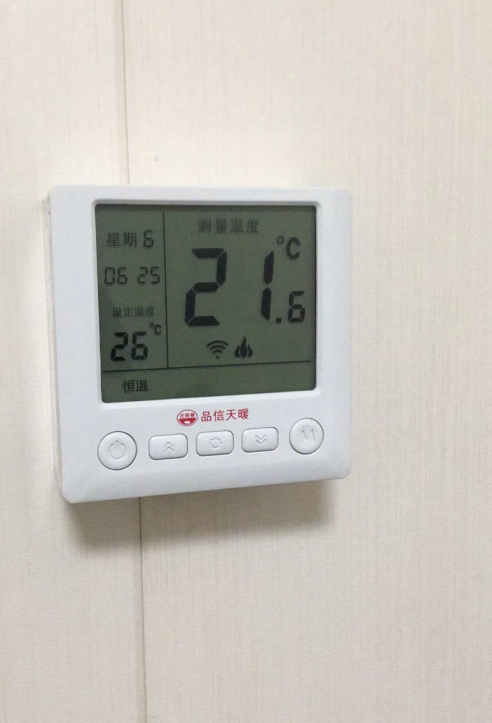
Where is `wall mounted thermostat`? The height and width of the screenshot is (723, 492). wall mounted thermostat is located at coordinates (79, 398).